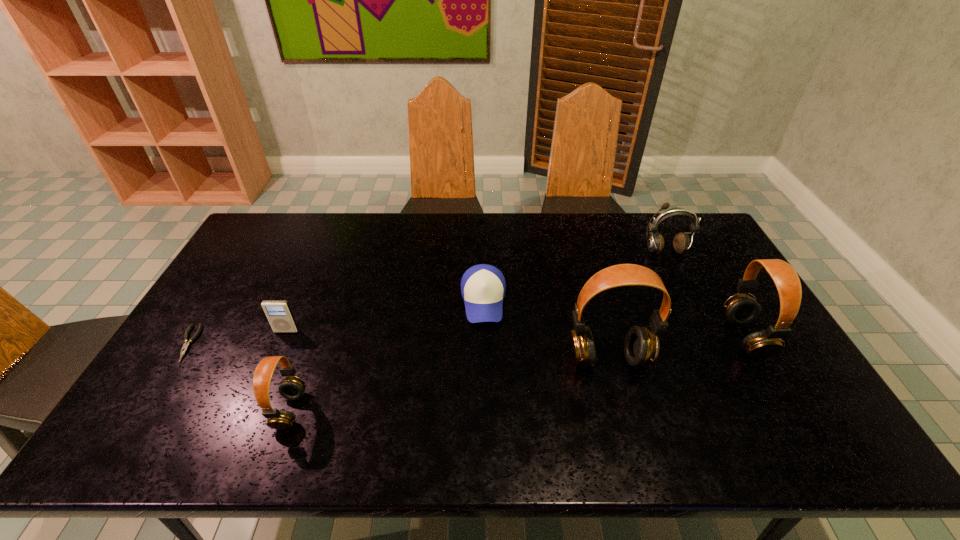
You are a GUI agent. You are given a task and a screenshot of the screen. Output one action in this format:
    pyautogui.click(x=<x>, y=<y>)
    Task: Click on the headset that stands as the second closest to the nearest object
    
    Given the screenshot: What is the action you would take?
    pyautogui.click(x=740, y=309)

Identify which headset is the nearest to the iPod. Please provide its 2D coordinates. Your answer should be formatted as a tuple, i.e. [(x, y)], where the tuple contains the x and y coordinates of a point satisfying the conditions above.

[(292, 387)]

This screenshot has height=540, width=960. In order to click on free point that satisfies the following two spatial constraints: 1. on the front-facing side of the baseball cap; 2. on the ear cups of the nearest object in this screenshot , I will do `click(484, 410)`.

You are a GUI agent. You are given a task and a screenshot of the screen. Output one action in this format:
    pyautogui.click(x=<x>, y=<y>)
    Task: Click on the vacant space that satisfies the following two spatial constraints: 1. on the front-facing side of the second shortest object; 2. on the ear cups of the leftmost headset
    
    Given the screenshot: What is the action you would take?
    pyautogui.click(x=484, y=410)

Identify the location of vacant space that satisfies the following two spatial constraints: 1. on the front-facing side of the fourth object from right to left; 2. on the ear cups of the fourth shortest object. The width and height of the screenshot is (960, 540). (484, 410).